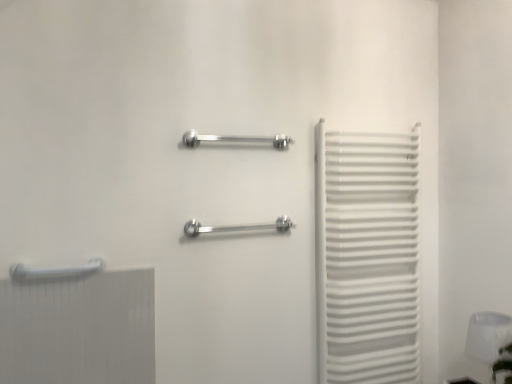
Question: Considering the relative sizes of polished metal towel rack at center, the 1th towel rack positioned from the right, and white glossy towel rack at right in the image provided, is polished metal towel rack at center, the 1th towel rack positioned from the right, wider than white glossy towel rack at right?

Choices:
 (A) no
 (B) yes

Answer: (A)

Question: Is polished metal towel rack at center, the 1th towel rack positioned from the right, bigger than white glossy towel rack at right?

Choices:
 (A) no
 (B) yes

Answer: (A)

Question: Is polished metal towel rack at center, which ranks as the third towel rack in left-to-right order, taller than white glossy towel rack at right?

Choices:
 (A) no
 (B) yes

Answer: (A)

Question: Is polished metal towel rack at center, the second towel rack positioned from the bottom, positioned behind white glossy towel rack at right?

Choices:
 (A) no
 (B) yes

Answer: (A)

Question: Is polished metal towel rack at center, the 1th towel rack positioned from the right, not within white glossy towel rack at right?

Choices:
 (A) yes
 (B) no

Answer: (A)

Question: From a real-world perspective, is polished metal towel rack at center, the second towel rack positioned from the bottom, physically below white glossy towel rack at right?

Choices:
 (A) yes
 (B) no

Answer: (B)

Question: Is there a large distance between polished metal towel rack at center, the 1th towel rack positioned from the right, and white glossy lampshade at lower right?

Choices:
 (A) no
 (B) yes

Answer: (A)

Question: Is polished metal towel rack at center, which ranks as the third towel rack in left-to-right order, to the right of white glossy lampshade at lower right from the viewer's perspective?

Choices:
 (A) yes
 (B) no

Answer: (B)

Question: Does polished metal towel rack at center, which is the second towel rack from top to bottom, lie in front of white glossy lampshade at lower right?

Choices:
 (A) no
 (B) yes

Answer: (A)

Question: Is polished metal towel rack at center, the second towel rack positioned from the bottom, thinner than white glossy lampshade at lower right?

Choices:
 (A) no
 (B) yes

Answer: (B)

Question: From the image's perspective, would you say polished metal towel rack at center, the 1th towel rack positioned from the right, is positioned over white glossy lampshade at lower right?

Choices:
 (A) no
 (B) yes

Answer: (B)

Question: Is polished metal towel rack at center, the 1th towel rack positioned from the right, placed right next to white glossy lampshade at lower right?

Choices:
 (A) no
 (B) yes

Answer: (A)

Question: Is white glossy towel rack at right positioned beyond the bounds of white glossy towel rack at lower left, positioned as the first towel rack in left-to-right order?

Choices:
 (A) no
 (B) yes

Answer: (B)